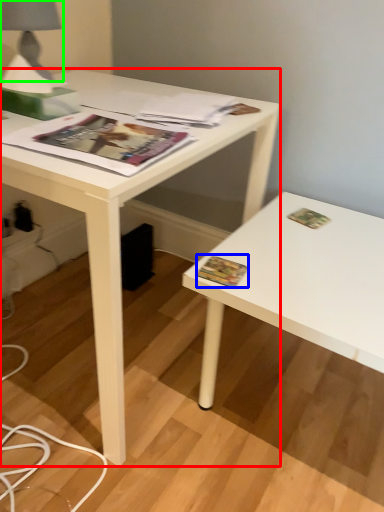
Question: Which object is positioned farthest from desk (highlighted by a red box)? Select from paperback book (highlighted by a blue box) and table lamp (highlighted by a green box).

Choices:
 (A) paperback book
 (B) table lamp

Answer: (A)